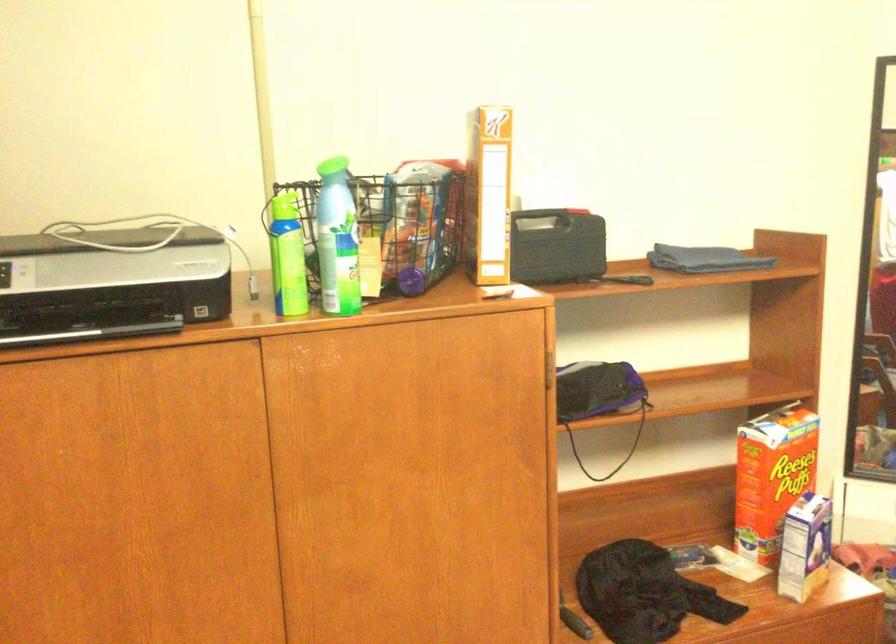
Describe the element at coordinates (556, 245) in the screenshot. The image size is (896, 644). I see `the black case handle` at that location.